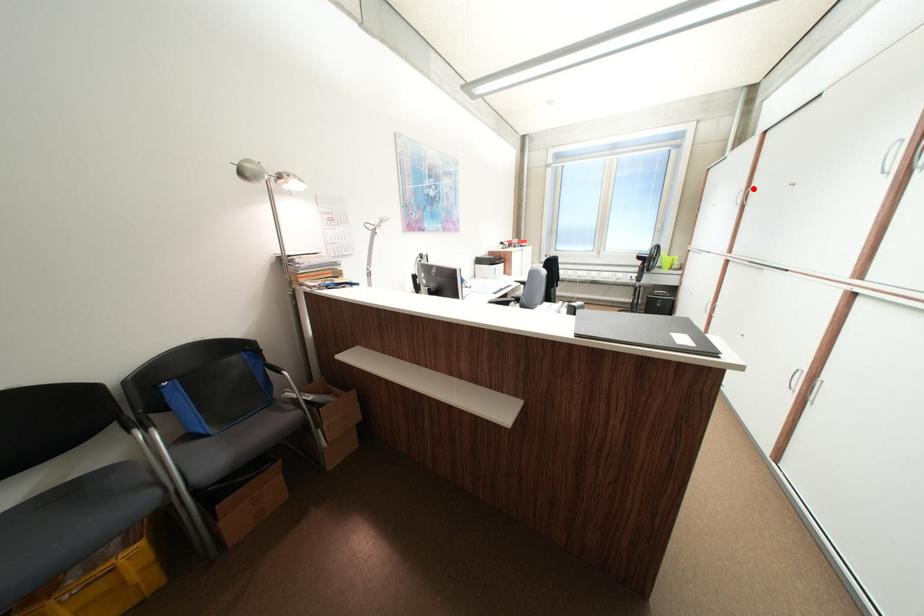
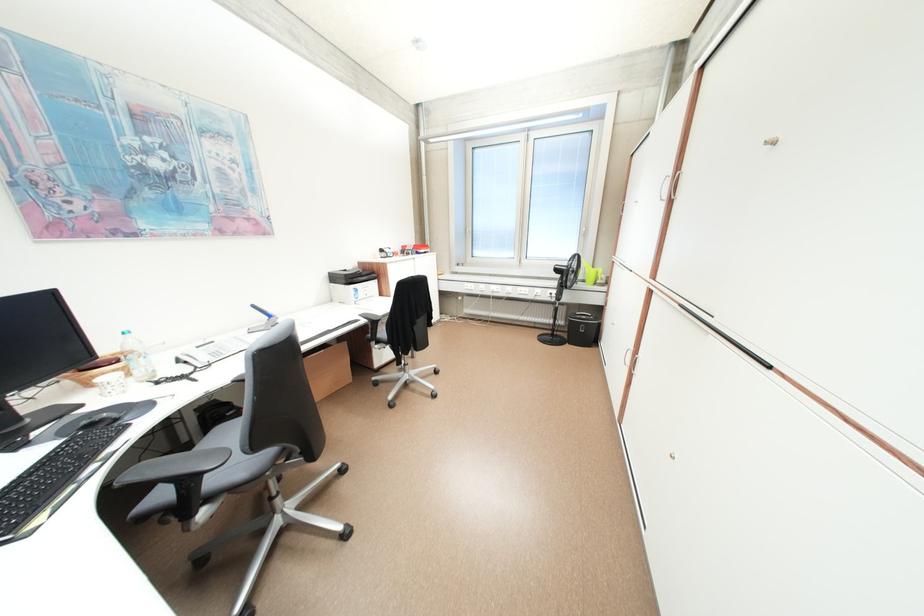
The point at the highlighted location is marked in the first image. Where is the corresponding point in the second image?

(679, 172)